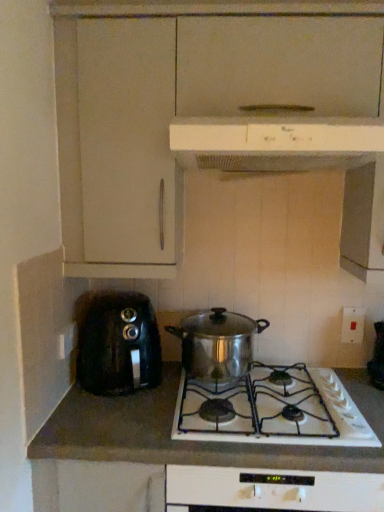
Question: From a real-world perspective, is white glossy stove at center positioned over white plastic range hood at upper center, the second kitchen appliance in the bottom-to-top sequence, based on gravity?

Choices:
 (A) yes
 (B) no

Answer: (B)

Question: From the image's perspective, is white glossy stove at center on white plastic range hood at upper center, arranged as the 1th kitchen appliance when viewed from the top?

Choices:
 (A) yes
 (B) no

Answer: (B)

Question: Can you confirm if white glossy stove at center is bigger than white plastic range hood at upper center, the second kitchen appliance in the bottom-to-top sequence?

Choices:
 (A) no
 (B) yes

Answer: (B)

Question: Considering the relative sizes of white glossy stove at center and white plastic range hood at upper center, the second kitchen appliance in the bottom-to-top sequence, in the image provided, is white glossy stove at center thinner than white plastic range hood at upper center, the second kitchen appliance in the bottom-to-top sequence,?

Choices:
 (A) yes
 (B) no

Answer: (B)

Question: Considering the relative positions of white glossy stove at center and white plastic range hood at upper center, arranged as the 1th kitchen appliance when viewed from the top, in the image provided, is white glossy stove at center in front of white plastic range hood at upper center, arranged as the 1th kitchen appliance when viewed from the top,?

Choices:
 (A) yes
 (B) no

Answer: (B)

Question: Is point (210, 387) closer or farther from the camera than point (117, 302)?

Choices:
 (A) farther
 (B) closer

Answer: (B)

Question: From a real-world perspective, is shiny silver gas stove at center positioned above or below black plastic toaster at left?

Choices:
 (A) below
 (B) above

Answer: (A)

Question: Looking at the image, does shiny silver gas stove at center seem bigger or smaller compared to black plastic toaster at left?

Choices:
 (A) small
 (B) big

Answer: (A)

Question: Choose the correct answer: Is shiny silver gas stove at center inside black plastic toaster at left or outside it?

Choices:
 (A) outside
 (B) inside

Answer: (A)

Question: From the image's perspective, is shiny silver gas stove at center above or below stainless steel pot at center, placed as the first kitchen appliance when sorted from bottom to top?

Choices:
 (A) above
 (B) below

Answer: (B)

Question: From a real-world perspective, relative to stainless steel pot at center, positioned as the second kitchen appliance in top-to-bottom order, is shiny silver gas stove at center vertically above or below?

Choices:
 (A) above
 (B) below

Answer: (B)

Question: Considering the positions of shiny silver gas stove at center and stainless steel pot at center, placed as the first kitchen appliance when sorted from bottom to top, in the image, is shiny silver gas stove at center bigger or smaller than stainless steel pot at center, placed as the first kitchen appliance when sorted from bottom to top,?

Choices:
 (A) small
 (B) big

Answer: (A)

Question: Considering the positions of point (x=327, y=397) and point (x=228, y=374), is point (x=327, y=397) closer or farther from the camera than point (x=228, y=374)?

Choices:
 (A) closer
 (B) farther

Answer: (A)

Question: Is white plastic range hood at upper center, the second kitchen appliance in the bottom-to-top sequence, wider or thinner than white plastic electric outlet at lower right, which is the second electric outlet from back to front?

Choices:
 (A) thin
 (B) wide

Answer: (B)

Question: From the image's perspective, relative to white plastic electric outlet at lower right, which is the 1th electric outlet from left to right, is white plastic range hood at upper center, the second kitchen appliance in the bottom-to-top sequence, above or below?

Choices:
 (A) above
 (B) below

Answer: (A)